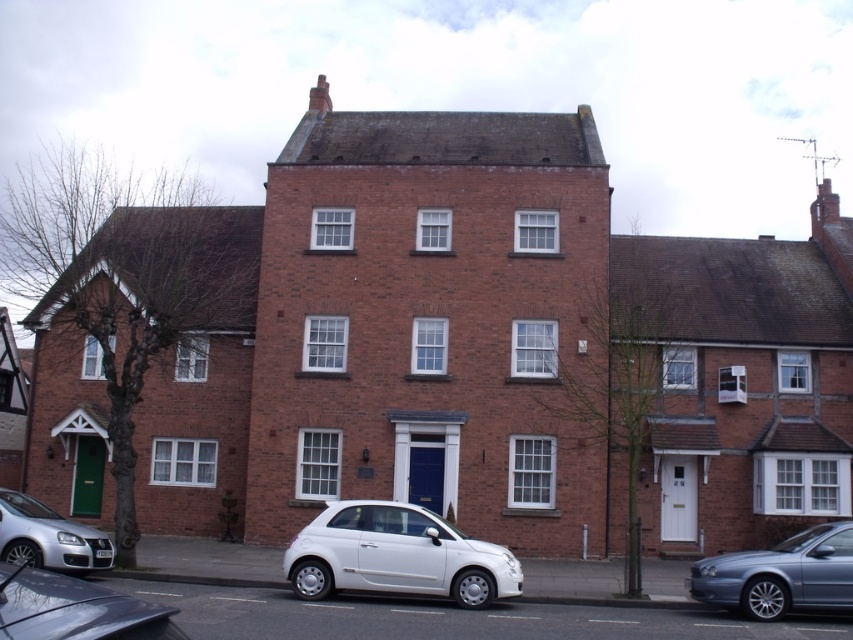
Question: Which point appears farthest from the camera in this image?

Choices:
 (A) (293, 557)
 (B) (74, 532)

Answer: (B)

Question: In this image, where is metallic gray sedan at lower right located relative to metallic gray hatchback at lower left?

Choices:
 (A) above
 (B) below

Answer: (B)

Question: Which object appears farthest from the camera in this image?

Choices:
 (A) metallic gray hatchback at lower left
 (B) white matte hatchback at center
 (C) metallic gray sedan at lower right
 (D) silver metallic hatchback at lower left

Answer: (D)

Question: Is metallic gray hatchback at lower left further to camera compared to silver metallic hatchback at lower left?

Choices:
 (A) yes
 (B) no

Answer: (B)

Question: Does white matte hatchback at center have a larger size compared to silver metallic hatchback at lower left?

Choices:
 (A) no
 (B) yes

Answer: (B)

Question: Among these objects, which one is nearest to the camera?

Choices:
 (A) silver metallic hatchback at lower left
 (B) metallic gray sedan at lower right
 (C) metallic gray hatchback at lower left

Answer: (C)